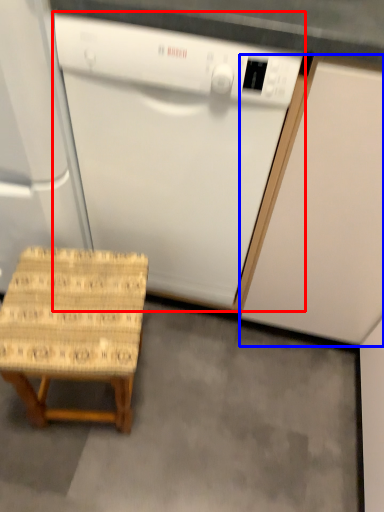
Question: Which point is closer to the camera, home appliance (highlighted by a red box) or cabinetry (highlighted by a blue box)?

Choices:
 (A) home appliance
 (B) cabinetry

Answer: (B)